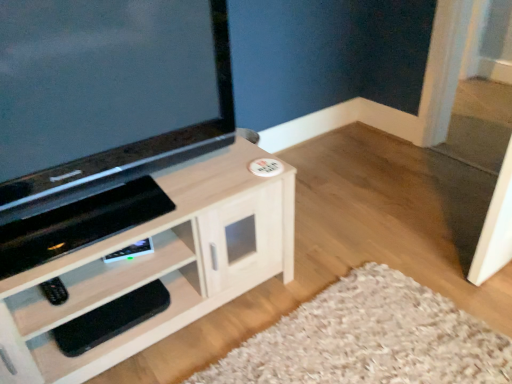
This screenshot has height=384, width=512. I want to click on free space underneath matte black tv at upper left (from a real-world perspective), so click(133, 202).